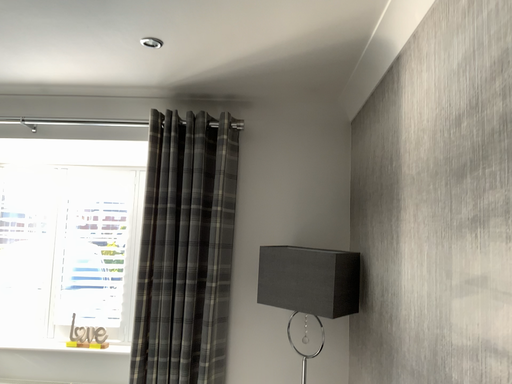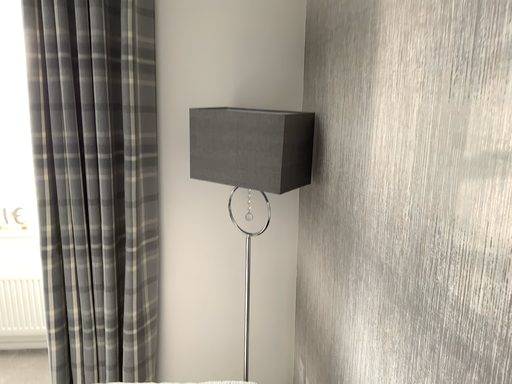
Question: Which way did the camera rotate in the video?

Choices:
 (A) rotated left
 (B) rotated right

Answer: (B)